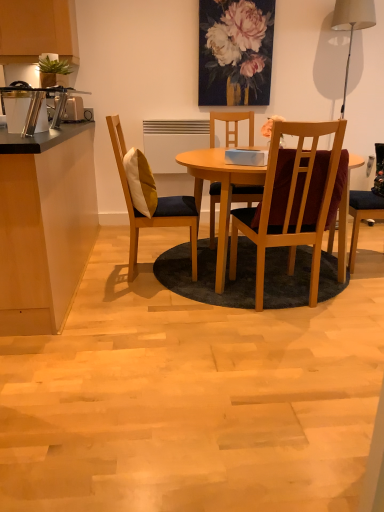
I want to click on vacant space in front of wooden table at center, so click(243, 352).